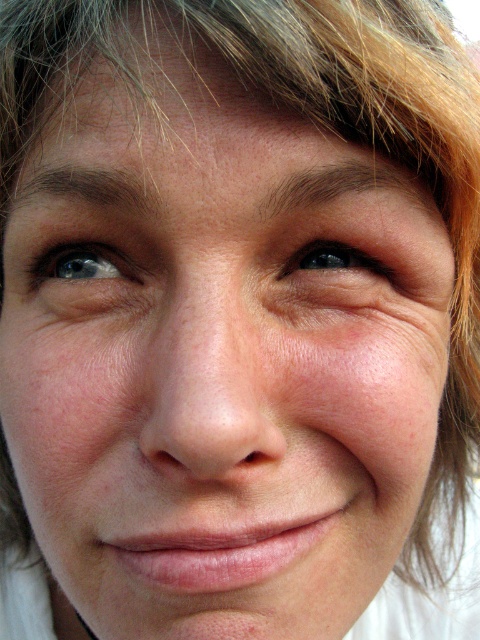
Consider the image. Who is more forward, (69, 268) or (373, 259)?

Point (373, 259) is more forward.

Between blue glossy eye at upper left and black glossy eye at upper center, which one has less height?

black glossy eye at upper center is shorter.

Image resolution: width=480 pixels, height=640 pixels. What are the coordinates of `blue glossy eye at upper left` in the screenshot? It's located at (83, 260).